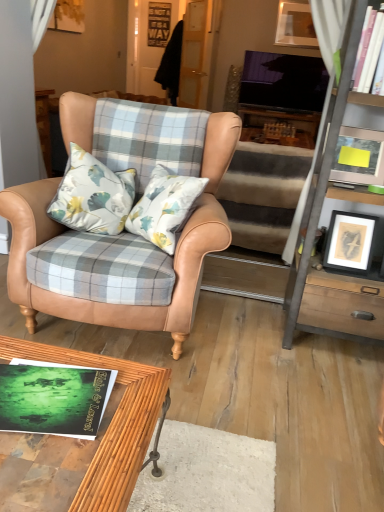
You are a GUI agent. You are given a task and a screenshot of the screen. Output one action in this format:
    pyautogui.click(x=<x>, y=<y>)
    Task: Click on the unoccupied region to the right of tan leather chair at center
    
    Given the screenshot: What is the action you would take?
    pyautogui.click(x=288, y=371)